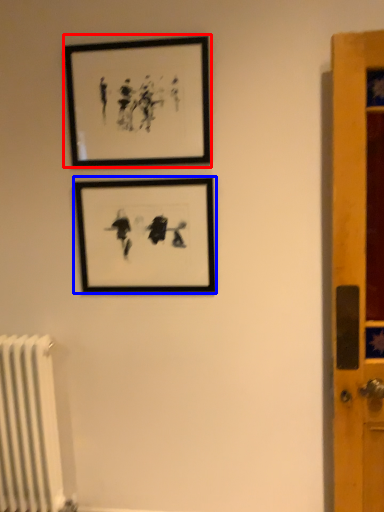
Question: Which of the following is the closest to the observer, picture frame (highlighted by a red box) or picture frame (highlighted by a blue box)?

Choices:
 (A) picture frame
 (B) picture frame

Answer: (A)